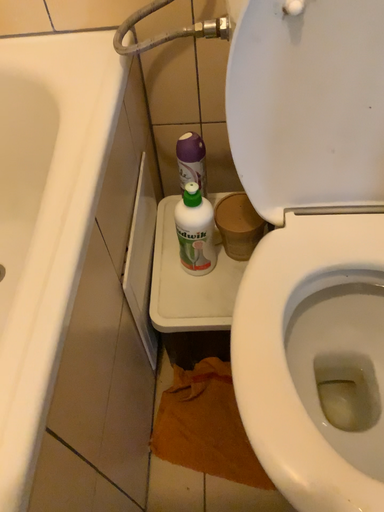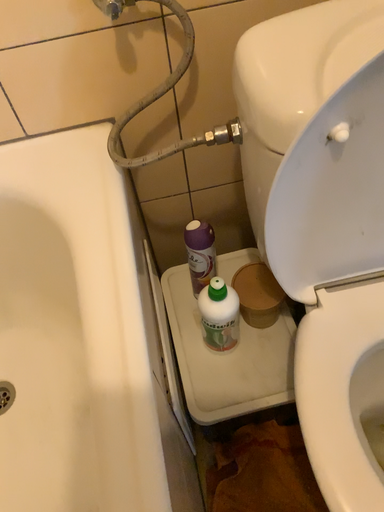
Question: How did the camera likely rotate when shooting the video?

Choices:
 (A) rotated right
 (B) rotated left

Answer: (A)